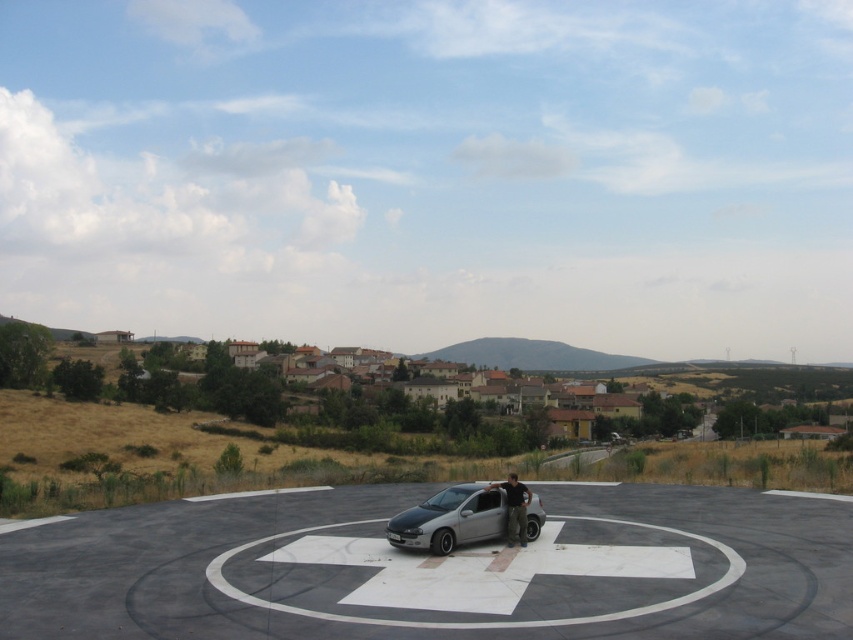
Question: Which of the following is the closest to the observer?

Choices:
 (A) silver metallic car at center
 (B) dark gray fabric pants at center

Answer: (A)

Question: Can you confirm if silver metallic car at center is thinner than dark gray fabric pants at center?

Choices:
 (A) yes
 (B) no

Answer: (B)

Question: Can you confirm if silver metallic car at center is positioned above dark gray fabric pants at center?

Choices:
 (A) yes
 (B) no

Answer: (A)

Question: Does concrete circle at center have a larger size compared to silver metallic car at center?

Choices:
 (A) no
 (B) yes

Answer: (B)

Question: Among these points, which one is nearest to the camera?

Choices:
 (A) coord(648,612)
 (B) coord(427,509)
 (C) coord(515,484)

Answer: (A)

Question: Based on their relative distances, which object is nearer to the concrete circle at center?

Choices:
 (A) silver metallic car at center
 (B) dark gray fabric pants at center

Answer: (A)